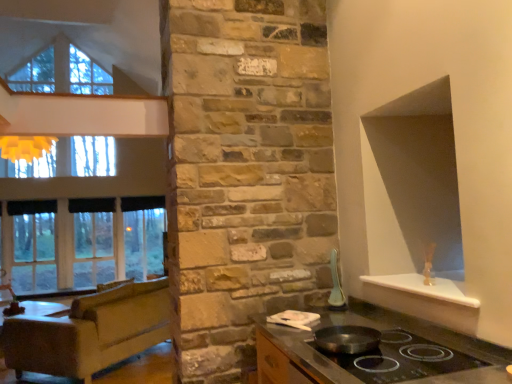
Question: Does black fabric curtain at left, arranged as the 1th curtain when viewed from the back, have a larger size compared to white glossy spoon at upper right?

Choices:
 (A) no
 (B) yes

Answer: (B)

Question: Is black fabric curtain at left, arranged as the 1th curtain when viewed from the back, next to white glossy spoon at upper right?

Choices:
 (A) yes
 (B) no

Answer: (B)

Question: Is black fabric curtain at left, arranged as the 1th curtain when viewed from the back, shorter than white glossy spoon at upper right?

Choices:
 (A) yes
 (B) no

Answer: (A)

Question: Is black fabric curtain at left, the second curtain when ordered from left to right, positioned with its back to white glossy spoon at upper right?

Choices:
 (A) no
 (B) yes

Answer: (A)

Question: Is black fabric curtain at left, the 2th curtain in the front-to-back sequence, not near white glossy spoon at upper right?

Choices:
 (A) no
 (B) yes

Answer: (B)

Question: In terms of size, does black fabric curtain at left, which is counted as the 1th curtain, starting from the front, appear bigger or smaller than brown leather couch at left?

Choices:
 (A) small
 (B) big

Answer: (A)

Question: In terms of width, does black fabric curtain at left, the 2th curtain viewed from the back, look wider or thinner when compared to brown leather couch at left?

Choices:
 (A) thin
 (B) wide

Answer: (A)

Question: Is black fabric curtain at left, the 2th curtain viewed from the back, taller or shorter than brown leather couch at left?

Choices:
 (A) short
 (B) tall

Answer: (A)

Question: From a real-world perspective, is black fabric curtain at left, the 2th curtain viewed from the back, above or below brown leather couch at left?

Choices:
 (A) below
 (B) above

Answer: (B)

Question: In the image, is shiny black wok at center positioned in front of or behind white glossy spoon at upper right?

Choices:
 (A) front
 (B) behind

Answer: (A)

Question: Looking at the image, does shiny black wok at center seem bigger or smaller compared to white glossy spoon at upper right?

Choices:
 (A) big
 (B) small

Answer: (A)

Question: From the image's perspective, relative to white glossy spoon at upper right, is shiny black wok at center above or below?

Choices:
 (A) above
 (B) below

Answer: (B)

Question: Is shiny black wok at center situated inside white glossy spoon at upper right or outside?

Choices:
 (A) outside
 (B) inside

Answer: (A)

Question: From a real-world perspective, is clear glass window at left above or below shiny black countertop at lower center?

Choices:
 (A) above
 (B) below

Answer: (A)

Question: Is clear glass window at left spatially inside shiny black countertop at lower center, or outside of it?

Choices:
 (A) inside
 (B) outside

Answer: (B)